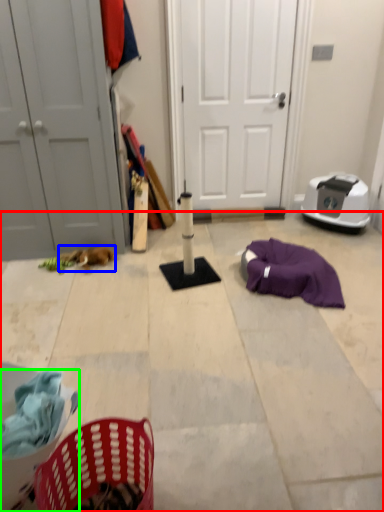
Question: Which object is positioned closest to concrete (highlighted by a red box)? Select from animal (highlighted by a blue box) and basket (highlighted by a green box).

Choices:
 (A) animal
 (B) basket

Answer: (A)